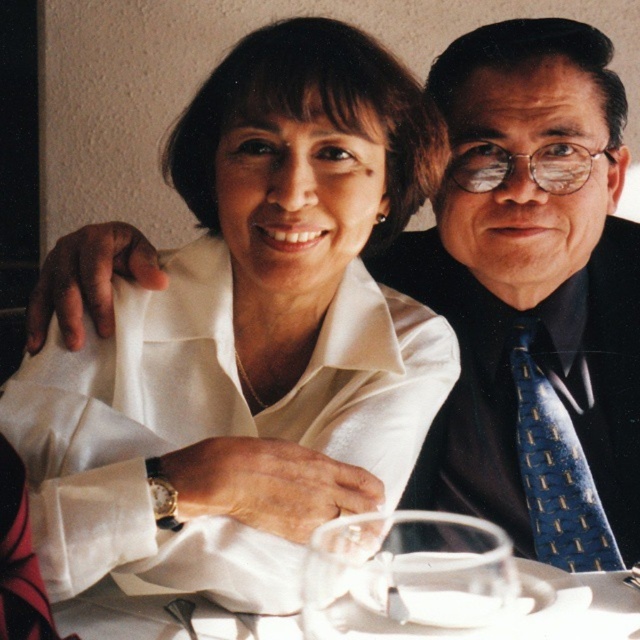
You are a photographer adjusting the camera focus. You want to ensure both the clear glass wine glass at center and the blue textured tie at right are in focus. Which object should you focus on first to achieve this?

Since the clear glass wine glass at center is closer to the viewer than the blue textured tie at right, you should focus on the blue textured tie at right first to ensure both are in focus.

You are a photographer adjusting the lighting for a portrait. You notice the clear glass wine glass at center and the blue textured tie at right. Which object is closer to the camera lens?

The blue textured tie at right is closer to the camera lens because the clear glass wine glass at center is positioned under it, indicating it is behind the tie in the scene.

You are a photographer setting up for a formal dinner photo shoot. You need to ensure that the satin white blouse at center is visible in the shot. Is the clear glass wine glass at center blocking it?

The satin white blouse at center is above the clear glass wine glass at center, so the wine glass is not blocking the blouse.